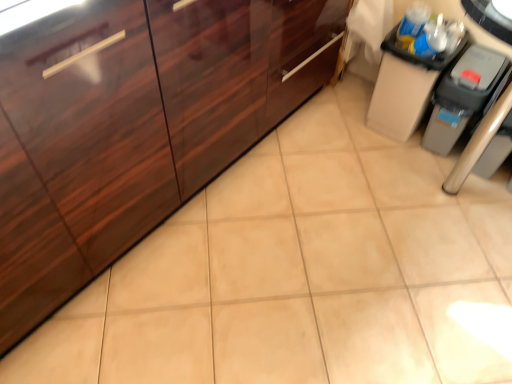
This screenshot has width=512, height=384. In order to click on free spot to the left of matte black trash can at upper right, positioned as the 1th cabinetry in right-to-left order in this screenshot , I will do `click(336, 120)`.